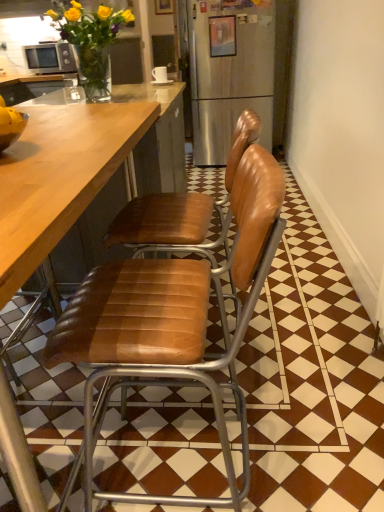
I want to click on vacant area that lies to the right of leather at center, which appears as the 1th chair when viewed from the front, so click(x=317, y=435).